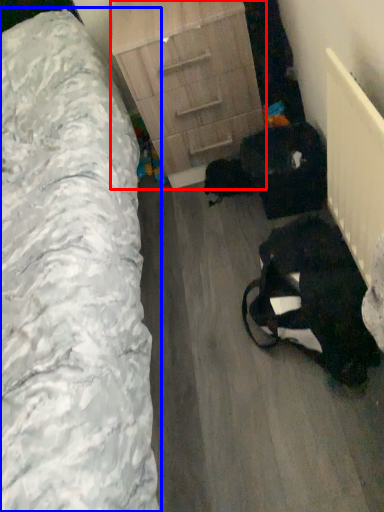
Question: Among these objects, which one is nearest to the camera, chest of drawers (highlighted by a red box) or furniture (highlighted by a blue box)?

Choices:
 (A) chest of drawers
 (B) furniture

Answer: (B)